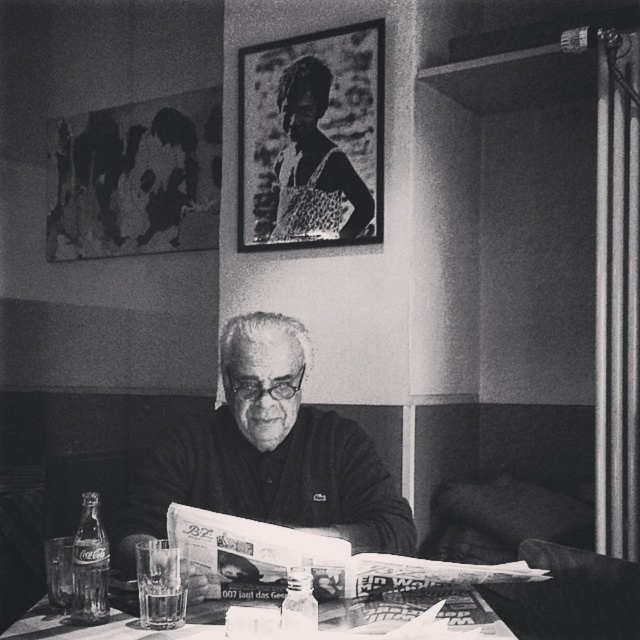
Does metallic frame at upper center appear on the left side of smooth glass table at center?

Incorrect, metallic frame at upper center is not on the left side of smooth glass table at center.

Does metallic frame at upper center appear over smooth glass table at center?

Correct, metallic frame at upper center is located above smooth glass table at center.

What do you see at coordinates (310, 140) in the screenshot? The height and width of the screenshot is (640, 640). I see `metallic frame at upper center` at bounding box center [310, 140].

The image size is (640, 640). I want to click on metallic frame at upper center, so tap(310, 140).

Describe the element at coordinates (269, 452) in the screenshot. I see `smooth black sweater at center` at that location.

Is smooth black sweater at center further to the viewer compared to metallic frame at upper center?

No, it is in front of metallic frame at upper center.

Find the location of a particular element. smooth black sweater at center is located at coordinates pyautogui.click(x=269, y=452).

Does smooth black sweater at center have a smaller size compared to smooth glass table at center?

No.

Is smooth black sweater at center bigger than smooth glass table at center?

Yes.

Which is in front, point (259, 499) or point (65, 630)?

Point (65, 630) is in front.

Where is `smooth black sweater at center`? smooth black sweater at center is located at coordinates (269, 452).